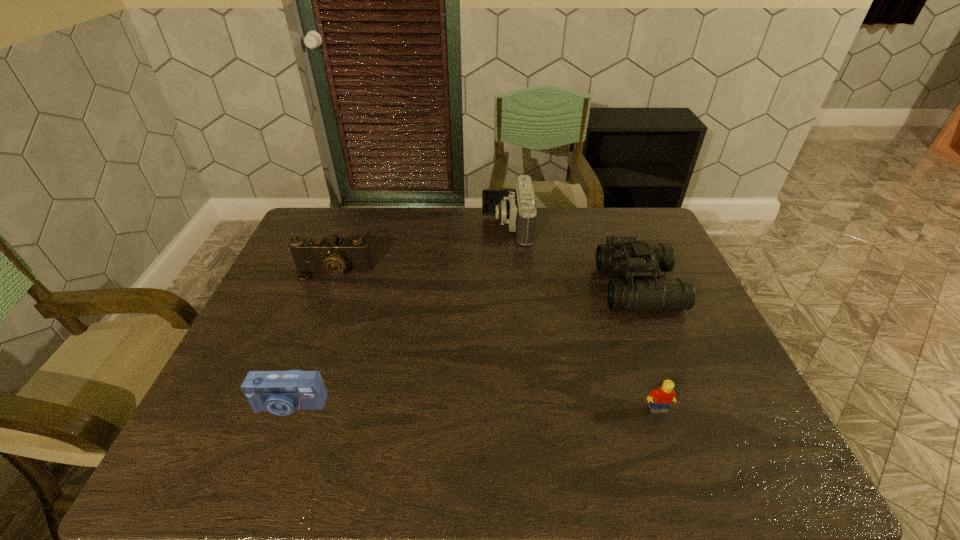
This screenshot has width=960, height=540. Identify the location of free space located 0.310m through the lenses of the binoculars. (496, 288).

Where is `free space located 0.060m through the lenses of the binoculars`? This screenshot has width=960, height=540. free space located 0.060m through the lenses of the binoculars is located at coordinates (581, 288).

Identify the location of vacant space located on the front-facing side of the second farthest camera. This screenshot has width=960, height=540. (321, 308).

Locate an element on the screen. free region located 0.120m on the front-facing side of the Lego is located at coordinates (x=677, y=466).

The height and width of the screenshot is (540, 960). Find the location of `vacant space positioned on the lens of the shortest camera`. vacant space positioned on the lens of the shortest camera is located at coordinates [266, 465].

Locate an element on the screen. The image size is (960, 540). object present at the far edge is located at coordinates (517, 208).

At what (x,y) coordinates should I click in order to perform the action: click on object that is at the right edge. Please return your answer as a coordinate pair (x, y). Looking at the image, I should click on (627, 255).

In the image, there is a desktop. Where is `free space at the far edge`? free space at the far edge is located at coordinates (496, 221).

The image size is (960, 540). I want to click on vacant space at the left edge of the desktop, so click(310, 303).

The height and width of the screenshot is (540, 960). I want to click on vacant region at the right edge, so click(x=704, y=393).